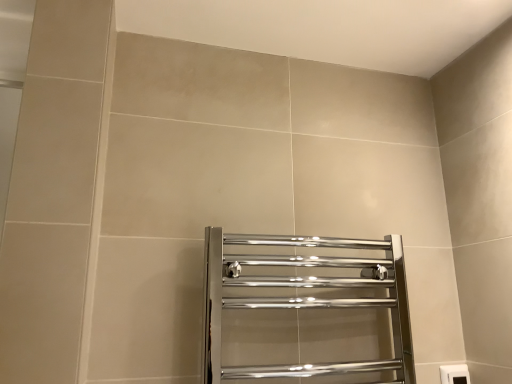
Image resolution: width=512 pixels, height=384 pixels. What are the coordinates of `white plastic electric outlet at lower right` in the screenshot? It's located at (454, 374).

What do you see at coordinates (454, 374) in the screenshot? I see `white plastic electric outlet at lower right` at bounding box center [454, 374].

Identify the location of white plastic electric outlet at lower right. The width and height of the screenshot is (512, 384). (454, 374).